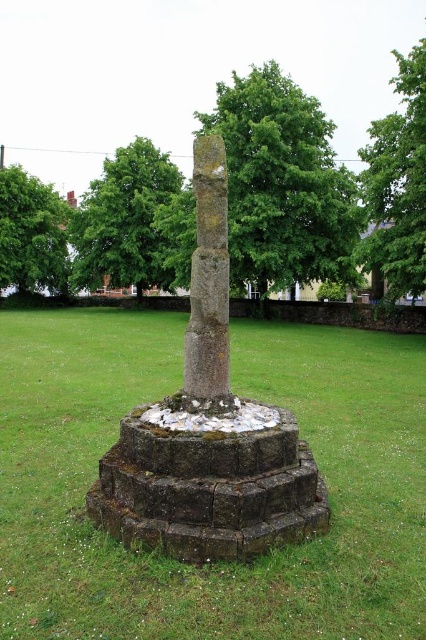
Which is in front, point (279, 240) or point (26, 196)?

Point (279, 240) is in front.

Is green leafy tree at center thinner than green leafy tree at upper left?

In fact, green leafy tree at center might be wider than green leafy tree at upper left.

Does point (281, 141) lie in front of point (14, 170)?

Yes, it is.

The image size is (426, 640). I want to click on green leafy tree at center, so click(282, 184).

Is rusty stone column at center behind green leafy tree at upper center?

No, it is not.

Based on the photo, who is taller, rusty stone column at center or green leafy tree at upper center?

green leafy tree at upper center

Is point (204, 468) less distant than point (143, 230)?

Yes, it is.

Where is `rusty stone column at center`? Image resolution: width=426 pixels, height=640 pixels. rusty stone column at center is located at coordinates (209, 432).

Can you confirm if rusty stone column at center is positioned to the right of green leafy tree at upper right?

In fact, rusty stone column at center is to the left of green leafy tree at upper right.

Does rusty stone column at center appear under green leafy tree at upper right?

Yes, rusty stone column at center is below green leafy tree at upper right.

This screenshot has width=426, height=640. What do you see at coordinates (209, 432) in the screenshot? I see `rusty stone column at center` at bounding box center [209, 432].

The height and width of the screenshot is (640, 426). Identify the location of rusty stone column at center. (209, 432).